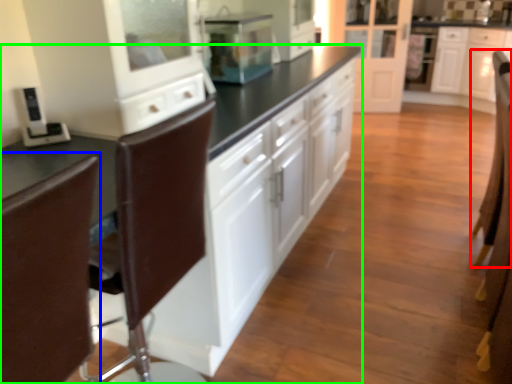
Question: Based on their relative distances, which object is farther from armchair (highlighted by a red box)? Choose from swivel chair (highlighted by a blue box) and cabinetry (highlighted by a green box).

Choices:
 (A) swivel chair
 (B) cabinetry

Answer: (A)